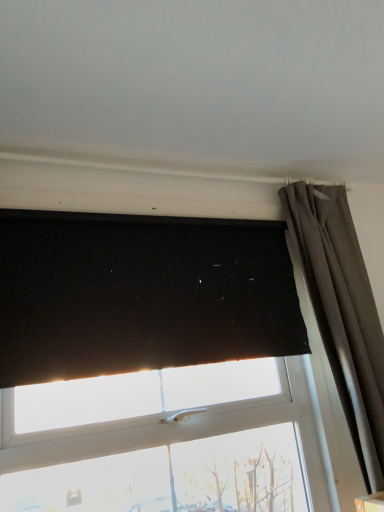
Question: Is point (377, 408) positioned closer to the camera than point (89, 410)?

Choices:
 (A) closer
 (B) farther

Answer: (B)

Question: From the image's perspective, is dark gray textured curtain at upper right located above or below black matte blind at upper center?

Choices:
 (A) above
 (B) below

Answer: (B)

Question: Considering the relative positions of dark gray textured curtain at upper right and black matte blind at upper center in the image provided, is dark gray textured curtain at upper right to the left or to the right of black matte blind at upper center?

Choices:
 (A) left
 (B) right

Answer: (B)

Question: Is black matte blind at upper center inside the boundaries of dark gray textured curtain at upper right, or outside?

Choices:
 (A) inside
 (B) outside

Answer: (B)

Question: Does point (253, 359) appear closer or farther from the camera than point (352, 237)?

Choices:
 (A) farther
 (B) closer

Answer: (B)

Question: Is black matte blind at upper center in front of or behind dark gray textured curtain at upper right in the image?

Choices:
 (A) behind
 (B) front

Answer: (B)

Question: Considering the positions of black matte blind at upper center and dark gray textured curtain at upper right in the image, is black matte blind at upper center bigger or smaller than dark gray textured curtain at upper right?

Choices:
 (A) big
 (B) small

Answer: (B)